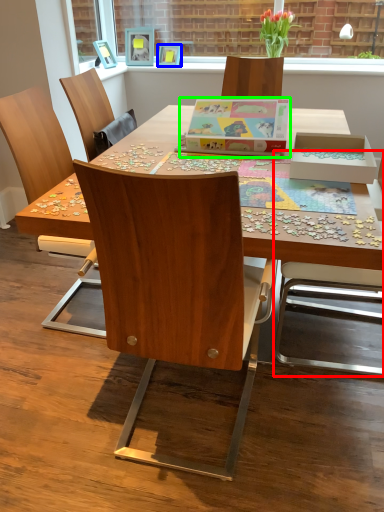
Question: Considering the real-world distances, which object is farthest from chair (highlighted by a red box)? picture frame (highlighted by a blue box) or cardboard box (highlighted by a green box)?

Choices:
 (A) picture frame
 (B) cardboard box

Answer: (A)